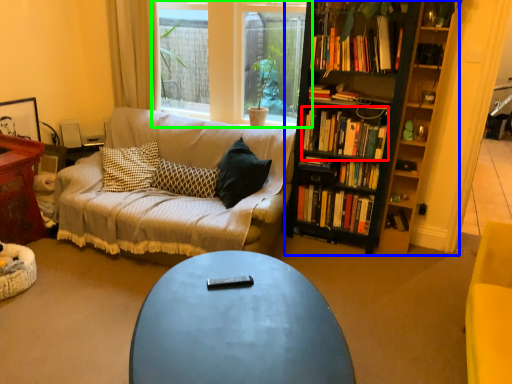
Question: Which is farther away from book (highlighted by a red box)? bookcase (highlighted by a blue box) or window (highlighted by a green box)?

Choices:
 (A) bookcase
 (B) window

Answer: (B)